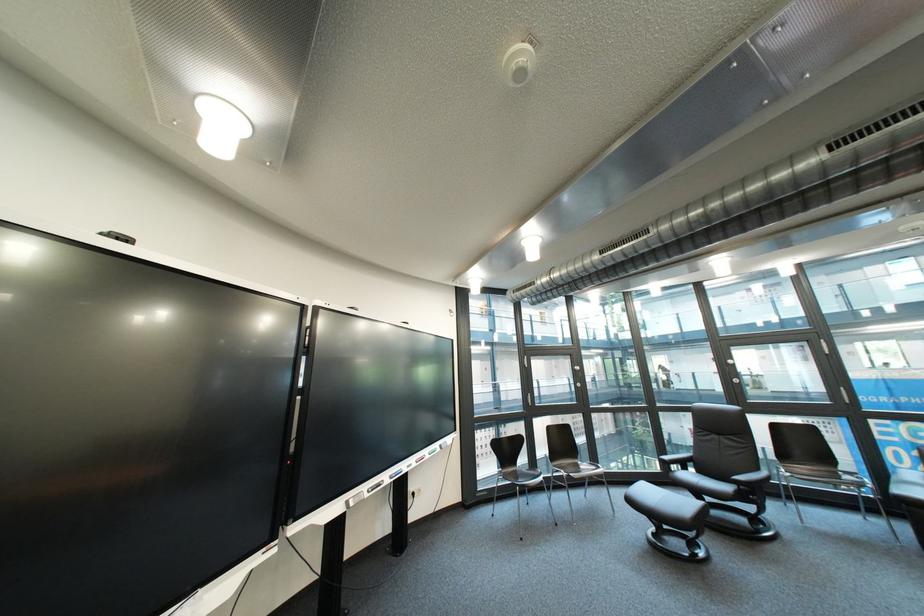
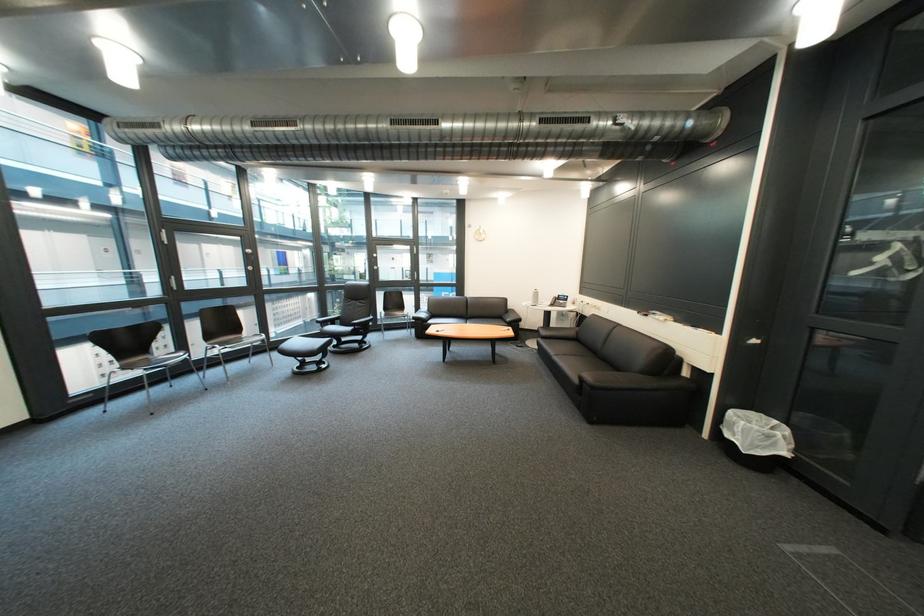
Where in the second image is the point corresponding to point 537,371 from the first image?

(176, 249)